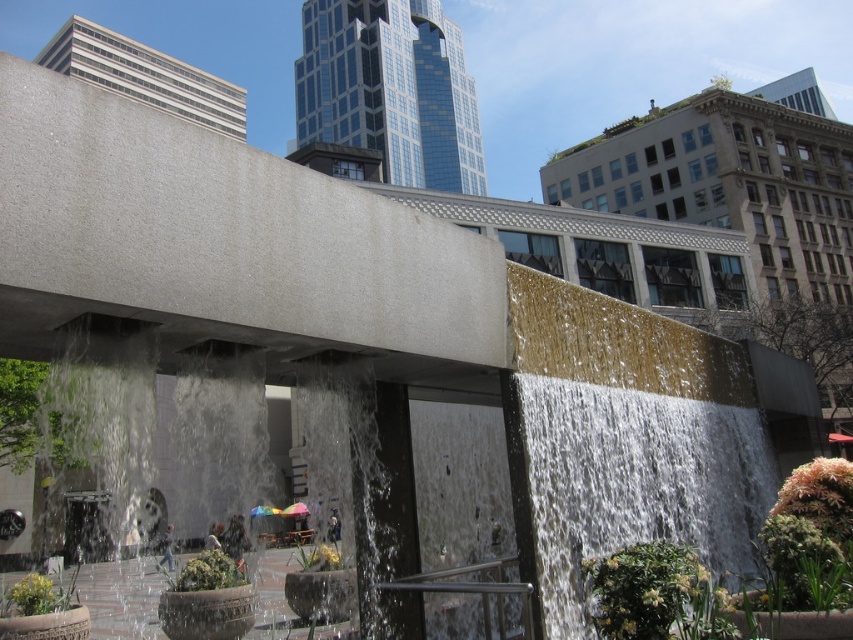
From the picture: Who is lower down, gold textured wall at center or smooth concrete waterfall at center?

gold textured wall at center

Does gold textured wall at center have a smaller size compared to smooth concrete waterfall at center?

No.

Find the location of `gold textured wall at center`. gold textured wall at center is located at coordinates (630, 436).